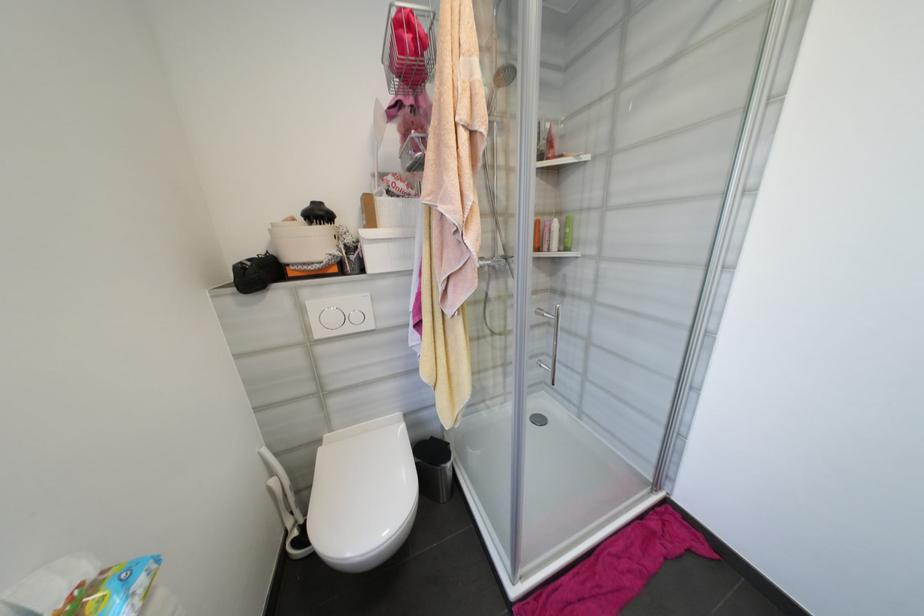
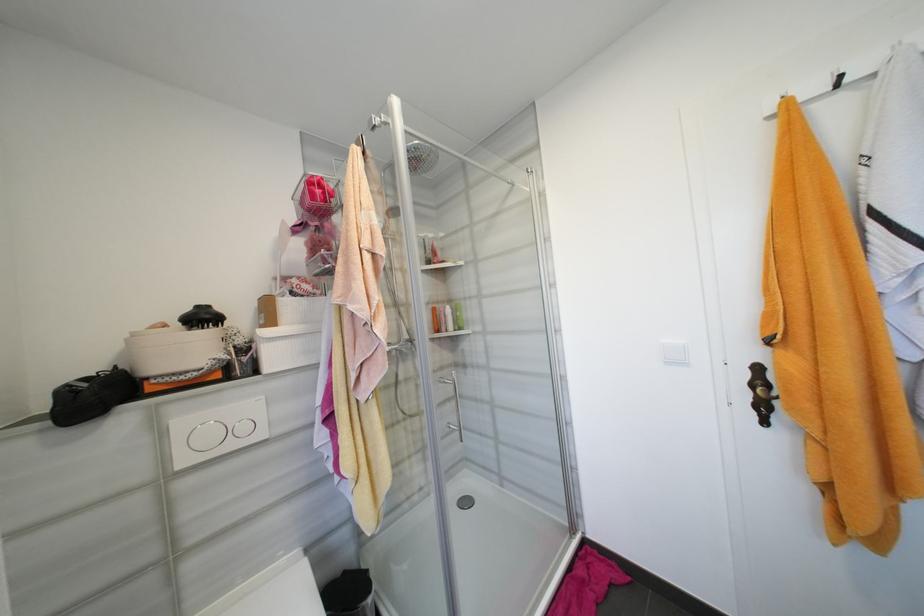
In the second image, find the point that corresponds to (324,216) in the first image.

(210, 318)